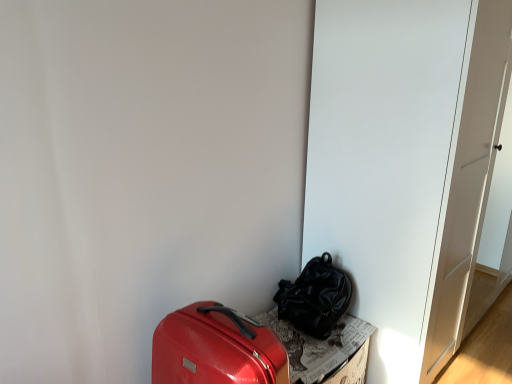
Question: Can you confirm if shiny black backpack at center, the first luggage and bags from the right, is thinner than cardboard textured box at lower right?

Choices:
 (A) no
 (B) yes

Answer: (B)

Question: From a real-world perspective, is shiny black backpack at center, the first luggage and bags from the right, on top of cardboard textured box at lower right?

Choices:
 (A) yes
 (B) no

Answer: (A)

Question: From the image's perspective, is shiny black backpack at center, which is counted as the second luggage and bags, starting from the front, beneath cardboard textured box at lower right?

Choices:
 (A) no
 (B) yes

Answer: (A)

Question: Considering the relative sizes of shiny black backpack at center, which is counted as the second luggage and bags, starting from the front, and cardboard textured box at lower right in the image provided, is shiny black backpack at center, which is counted as the second luggage and bags, starting from the front, bigger than cardboard textured box at lower right?

Choices:
 (A) yes
 (B) no

Answer: (B)

Question: Does shiny black backpack at center, the 1th luggage and bags when ordered from back to front, turn towards cardboard textured box at lower right?

Choices:
 (A) no
 (B) yes

Answer: (A)

Question: Can you confirm if shiny black backpack at center, the first luggage and bags from the right, is positioned to the right of cardboard textured box at lower right?

Choices:
 (A) yes
 (B) no

Answer: (A)

Question: Is shiny black backpack at center, the 1th luggage and bags when ordered from back to front, completely or partially outside of white matte door at center?

Choices:
 (A) no
 (B) yes

Answer: (B)

Question: Can you confirm if shiny black backpack at center, the 1th luggage and bags when ordered from back to front, is wider than white matte door at center?

Choices:
 (A) no
 (B) yes

Answer: (A)

Question: Is shiny black backpack at center, the 1th luggage and bags when ordered from back to front, smaller than white matte door at center?

Choices:
 (A) yes
 (B) no

Answer: (A)

Question: Can you confirm if shiny black backpack at center, the first luggage and bags from the right, is shorter than white matte door at center?

Choices:
 (A) yes
 (B) no

Answer: (A)

Question: From a real-world perspective, does shiny black backpack at center, the first luggage and bags from the right, sit lower than white matte door at center?

Choices:
 (A) no
 (B) yes

Answer: (B)

Question: Could you tell me if shiny black backpack at center, the first luggage and bags from the right, is facing white matte door at center?

Choices:
 (A) yes
 (B) no

Answer: (B)

Question: Is white matte door at center touching shiny red suitcase at lower left, the first luggage and bags positioned from the front?

Choices:
 (A) yes
 (B) no

Answer: (B)